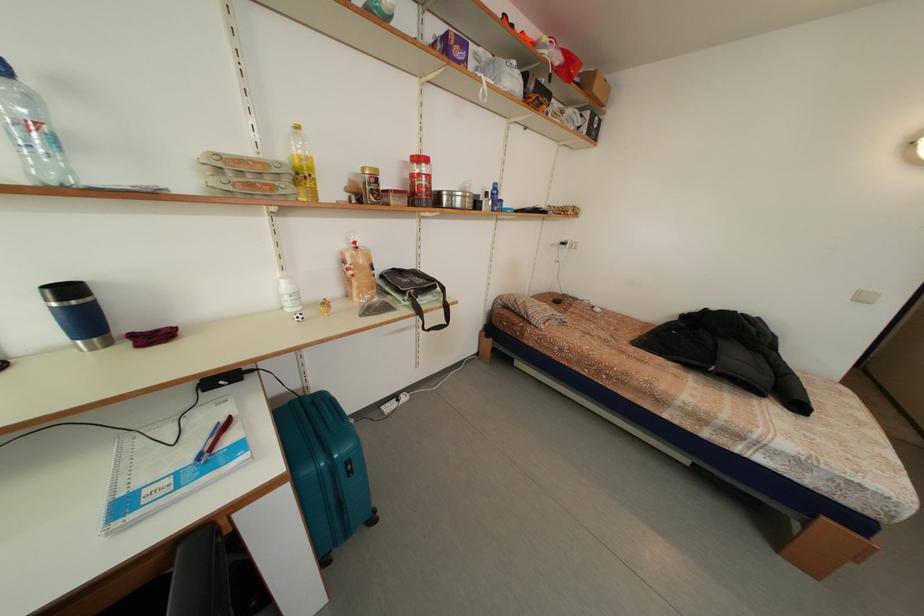
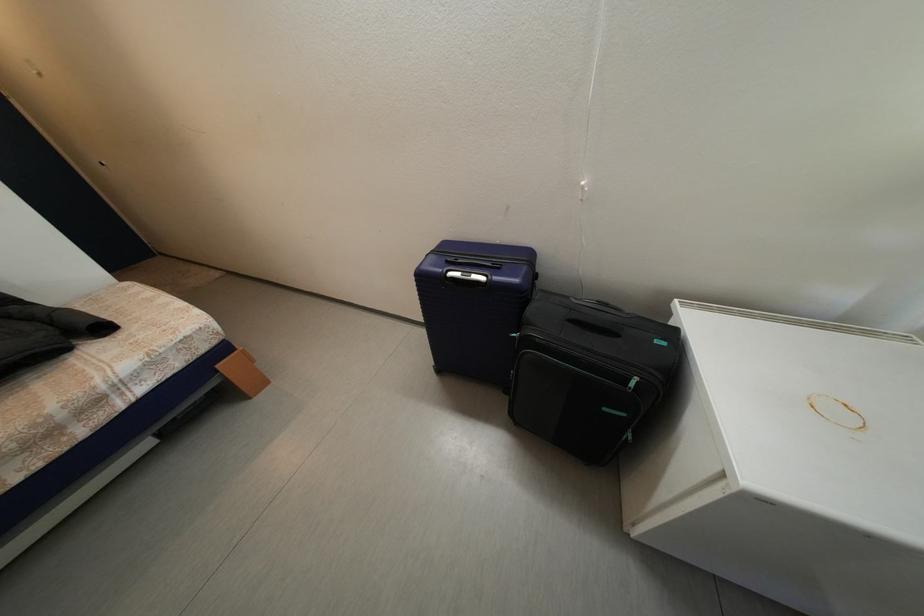
The first image is from the beginning of the video and the second image is from the end. How did the camera likely rotate when shooting the video?

The camera's rotation is toward right-down.